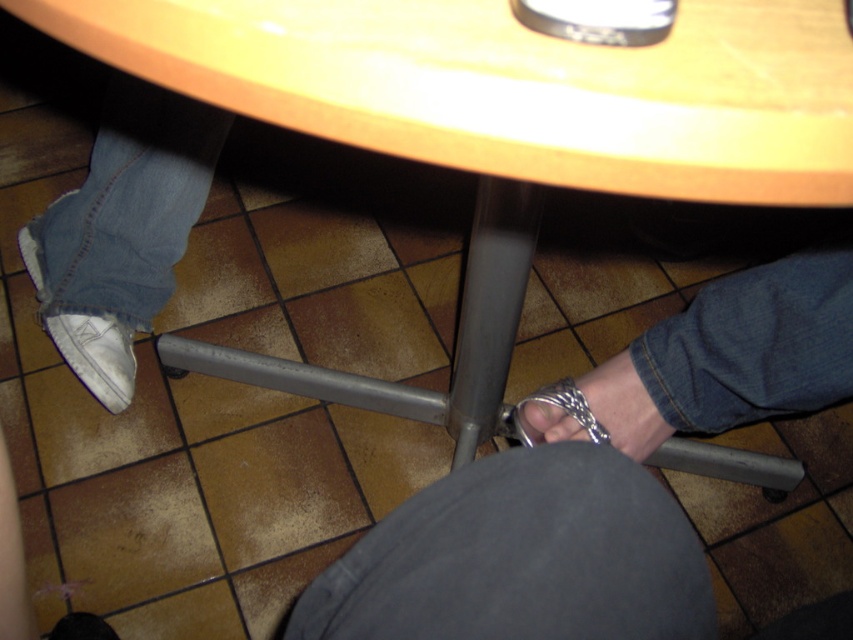
You are a security guard inspecting the area under the table. You notice two items at the lower center of your view. Which one is taller between the silver metallic handcuffs at lower center and the silver metallic toe at lower center?

The silver metallic handcuffs at lower center are taller than the silver metallic toe at lower center according to the description.

You are a photographer setting up a shoot under a table. You notice the silver metallic chain at lower right and the white suede shoe at lower left. Which object is closer to the camera lens based on their positions?

The silver metallic chain at lower right is not as tall as the white suede shoe at lower left, so the white suede shoe at lower left is closer to the camera lens.

You are a delivery robot with a height of 1 meter. You need to navigate under the table shown in the image. The table has a metallic leg extending downward and slightly to the right. There is a point at coordinates point (740, 406) that is 88.85 centimeters away from the camera. Can you fit under the table without hitting your head?

The point at coordinates point (740, 406) is 88.85 centimeters away from the camera. Since the delivery robot is 1 meter tall, it is taller than the clearance provided by the table, so it cannot fit under the table without hitting its head.